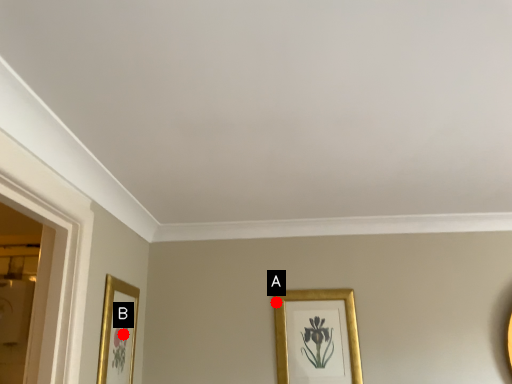
Question: Two points are circled on the image, labeled by A and B beside each circle. Which point is farther from the camera taking this photo?

Choices:
 (A) A is further
 (B) B is further

Answer: (A)